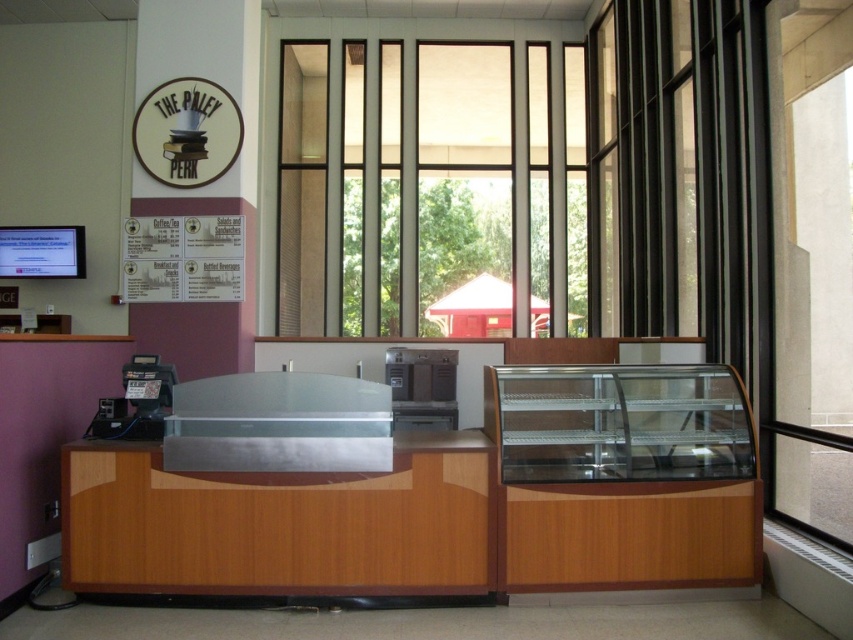
Can you confirm if transparent glass window at center is thinner than wooden/polisheddesk at center?

Incorrect, transparent glass window at center's width is not less than wooden/polisheddesk at center's.

Can you confirm if transparent glass window at center is smaller than wooden/polisheddesk at center?

Actually, transparent glass window at center might be larger than wooden/polisheddesk at center.

Does point (335, 308) come behind point (309, 481)?

Yes, point (335, 308) is behind point (309, 481).

The image size is (853, 640). I want to click on transparent glass window at center, so click(434, 180).

Can you confirm if transparent glass window at center is positioned to the right of matte brown sign at upper center?

Yes, transparent glass window at center is to the right of matte brown sign at upper center.

Can you confirm if transparent glass window at center is thinner than matte brown sign at upper center?

In fact, transparent glass window at center might be wider than matte brown sign at upper center.

Find the location of a particular element. This screenshot has height=640, width=853. transparent glass window at center is located at coordinates (434, 180).

Does wooden/polisheddesk at center have a greater width compared to wooden display case at right?

Yes, wooden/polisheddesk at center is wider than wooden display case at right.

Does wooden/polisheddesk at center have a greater height compared to wooden display case at right?

Incorrect, wooden/polisheddesk at center's height is not larger of wooden display case at right's.

Is point (424, 438) closer to viewer compared to point (589, 385)?

Yes, it is in front of point (589, 385).

What are the coordinates of `wooden/polisheddesk at center` in the screenshot? It's located at (281, 524).